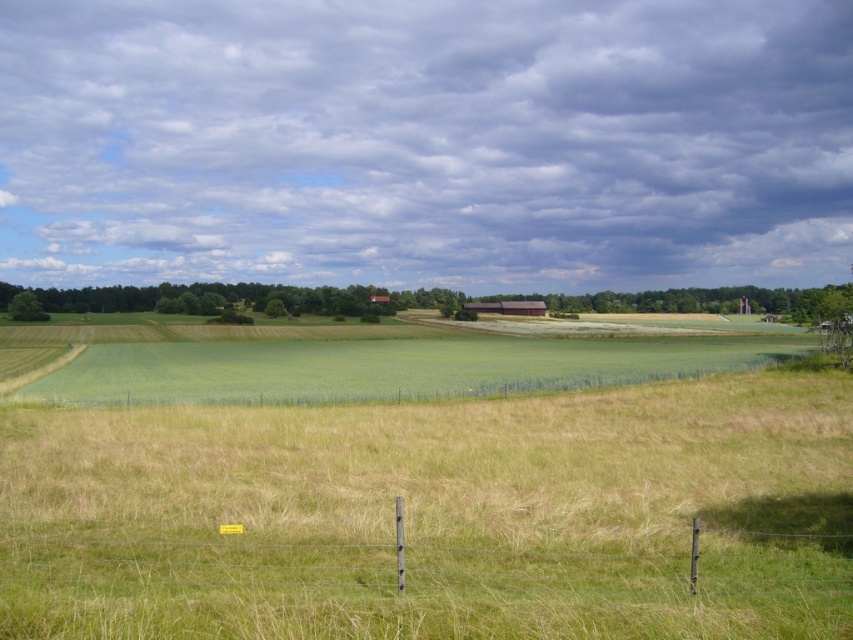
You are a farmer checking the fields. You see the green grassy wheat field at center and the green grassy fence at lower center. Which one covers a bigger area?

The green grassy wheat field at center is larger in size than the green grassy fence at lower center, so it covers a bigger area.